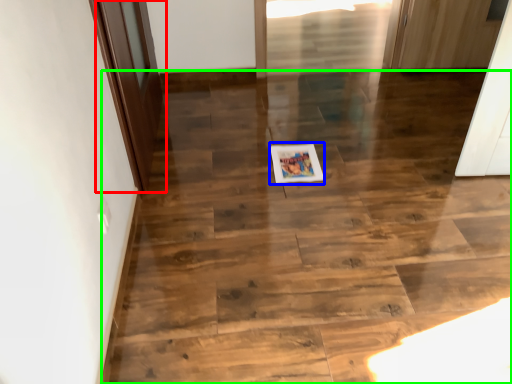
Question: Estimate the real-world distances between objects in this image. Which object is farther from door (highlighted by a red box), postcard (highlighted by a blue box) or stairwell (highlighted by a green box)?

Choices:
 (A) postcard
 (B) stairwell

Answer: (A)